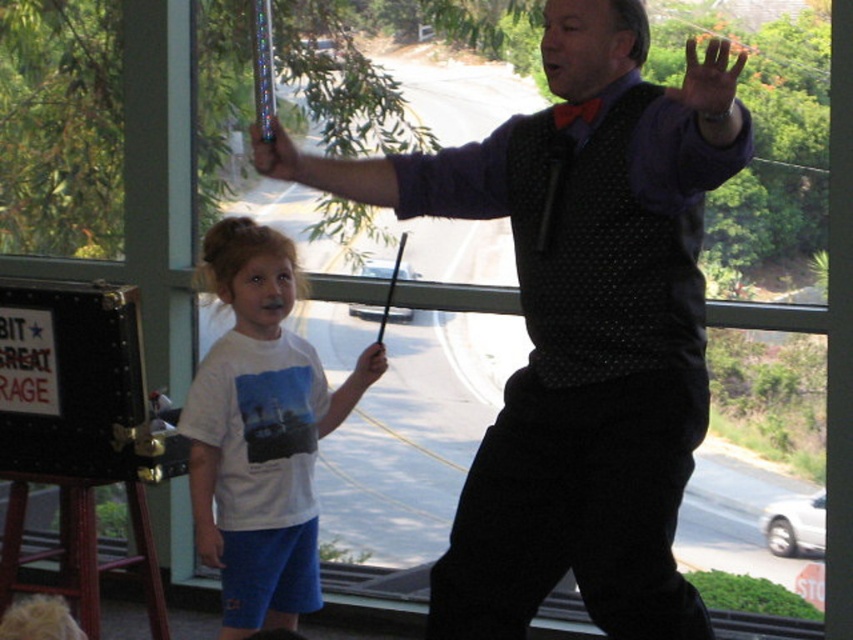
Is smooth skin hand at upper right bigger than metallic wand at upper center?

Yes.

Who is taller, smooth skin hand at upper right or metallic wand at upper center?

smooth skin hand at upper right is taller.

Image resolution: width=853 pixels, height=640 pixels. I want to click on smooth skin hand at upper right, so click(x=709, y=81).

From the picture: Can you confirm if black leather easel at left is wider than smooth skin hand at upper right?

Indeed, black leather easel at left has a greater width compared to smooth skin hand at upper right.

Is point (165, 460) positioned before point (714, 104)?

No, (165, 460) is further to viewer.

Locate an element on the screen. This screenshot has height=640, width=853. black leather easel at left is located at coordinates (79, 433).

Is white cotton shirt at center to the left of smooth skin hand at upper right from the viewer's perspective?

Yes, white cotton shirt at center is to the left of smooth skin hand at upper right.

Is white cotton shirt at center to the right of smooth skin hand at upper right from the viewer's perspective?

No, white cotton shirt at center is not to the right of smooth skin hand at upper right.

Does point (280, 291) lie behind point (724, 67)?

Yes, point (280, 291) is behind point (724, 67).

Where is `white cotton shirt at center`? This screenshot has width=853, height=640. white cotton shirt at center is located at coordinates (257, 435).